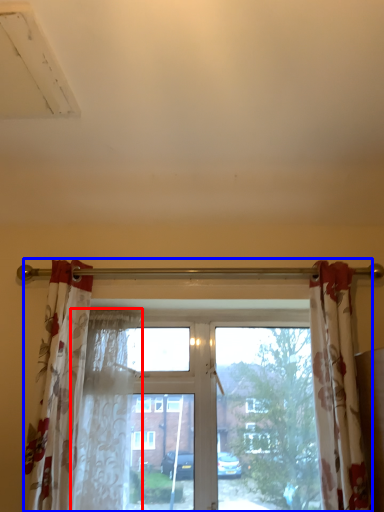
Question: Among these objects, which one is nearest to the camera, shower curtain (highlighted by a red box) or window (highlighted by a blue box)?

Choices:
 (A) shower curtain
 (B) window

Answer: (A)